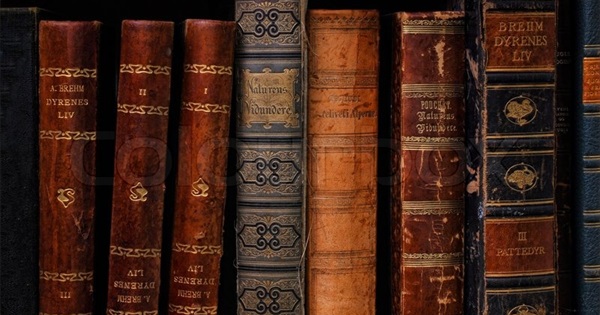
Locate an element on the screen. Image resolution: width=600 pixels, height=315 pixels. books is located at coordinates pyautogui.click(x=80, y=137), pyautogui.click(x=156, y=131), pyautogui.click(x=194, y=131), pyautogui.click(x=253, y=132), pyautogui.click(x=340, y=141), pyautogui.click(x=432, y=143), pyautogui.click(x=505, y=154), pyautogui.click(x=577, y=150).